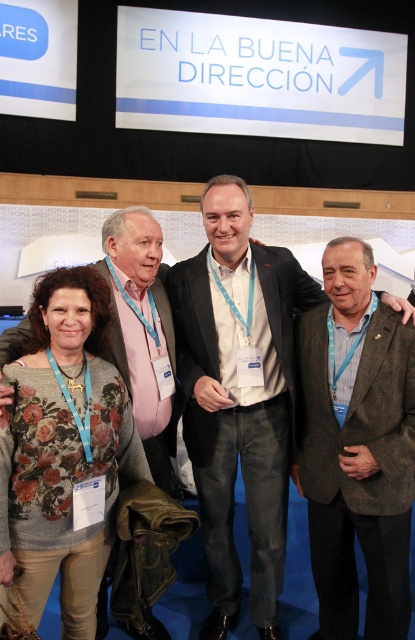
Who is higher up, brown woolen jacket at center or floral sweater at lower left?

floral sweater at lower left is above.

Who is taller, brown woolen jacket at center or floral sweater at lower left?

With more height is brown woolen jacket at center.

Is point (329, 467) less distant than point (53, 324)?

No.

At what (x,y) coordinates should I click in order to perform the action: click on brown woolen jacket at center. Please return your answer as a coordinate pair (x, y). The width and height of the screenshot is (415, 640). Looking at the image, I should click on (356, 448).

Consider the image. Is light brown woolen blazer at center thinner than brown woolen jacket at center?

Incorrect, light brown woolen blazer at center's width is not less than brown woolen jacket at center's.

Does light brown woolen blazer at center have a greater width compared to brown woolen jacket at center?

Indeed, light brown woolen blazer at center has a greater width compared to brown woolen jacket at center.

This screenshot has width=415, height=640. What do you see at coordinates (239, 396) in the screenshot?
I see `light brown woolen blazer at center` at bounding box center [239, 396].

This screenshot has height=640, width=415. I want to click on light brown woolen blazer at center, so click(239, 396).

Is light brown woolen blazer at center positioned behind floral sweater at lower left?

Yes.

Who is positioned more to the right, light brown woolen blazer at center or floral sweater at lower left?

light brown woolen blazer at center is more to the right.

At what (x,y) coordinates should I click in order to perform the action: click on light brown woolen blazer at center. Please return your answer as a coordinate pair (x, y). The width and height of the screenshot is (415, 640). Looking at the image, I should click on (239, 396).